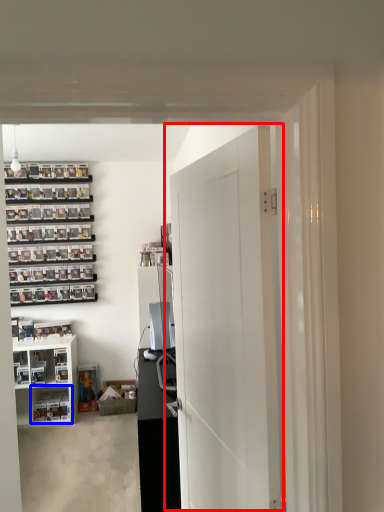
Question: Which object is further to the camera taking this photo, door (highlighted by a red box) or shelf (highlighted by a blue box)?

Choices:
 (A) door
 (B) shelf

Answer: (B)